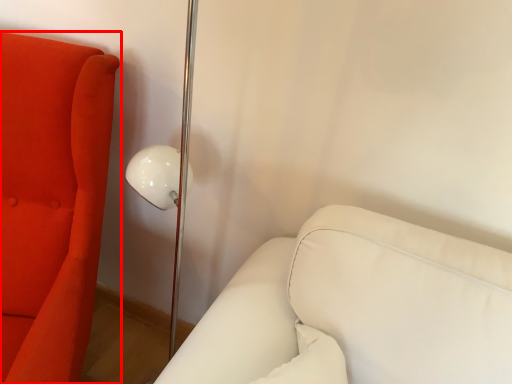
Question: Considering the relative positions of furniture (annotated by the red box) and furniture in the image provided, where is furniture (annotated by the red box) located with respect to the staircase?

Choices:
 (A) right
 (B) left

Answer: (B)